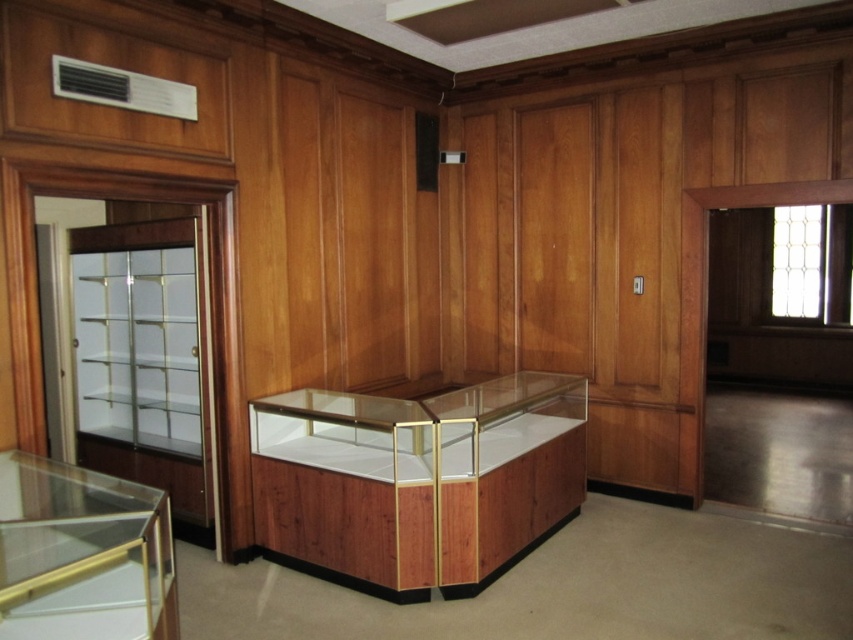
Question: Does wooden display case at center lie in front of transparent glass case at lower left?

Choices:
 (A) no
 (B) yes

Answer: (A)

Question: Which object appears farthest from the camera in this image?

Choices:
 (A) transparent glass case at lower left
 (B) wooden display case at center

Answer: (B)

Question: Considering the relative positions of wooden display case at center and transparent glass case at lower left in the image provided, where is wooden display case at center located with respect to transparent glass case at lower left?

Choices:
 (A) below
 (B) above

Answer: (A)

Question: Which point is closer to the camera taking this photo?

Choices:
 (A) (71, 504)
 (B) (479, 564)

Answer: (A)

Question: Is wooden display case at center bigger than transparent glass case at lower left?

Choices:
 (A) yes
 (B) no

Answer: (A)